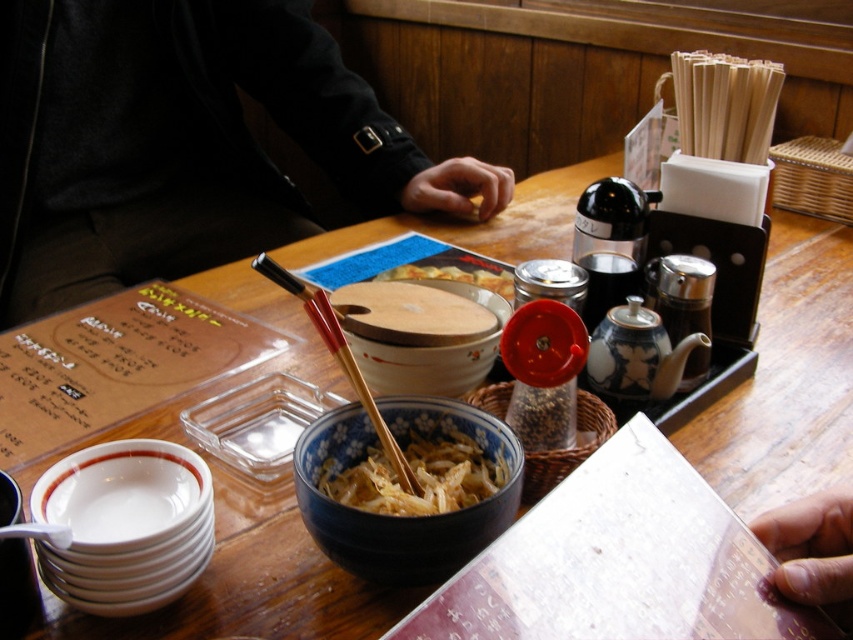
You are a diner sitting at the table and want to reach both the blue ceramic bowl at center and the wooden chopsticks at center. Which item will your hand touch first when reaching out?

The blue ceramic bowl at center will be touched first because it is closer to the viewer than the wooden chopsticks at center.

Looking at this image, you are a diner at a Japanese restaurant and want to use the wooden chopsticks at center to eat the food from the blue ceramic bowl at center. Can you reach the bowl without moving the chopsticks?

The blue ceramic bowl at center is bigger than wooden chopsticks at center, but this size difference doesn not indicate their positions. Since both are at the center, you can likely reach the bowl without moving the chopsticks.

You are a photographer taking a picture of the dining table. You want to focus on the point at coordinates point (437, 432). If your camera has a depth of field that can clearly capture objects within 20 inches from the camera, will the point be in focus?

The point (437, 432) is 20.54 inches from the camera, which is slightly beyond the 20 inches depth of field range. Therefore, the point will be out of focus.